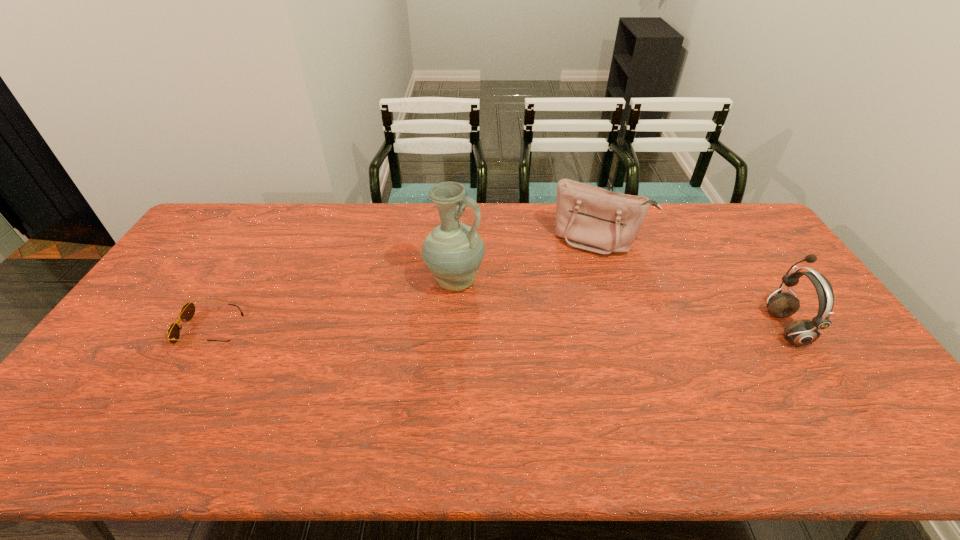
Find the location of `free space located on the ear pads of the rightmost object`. free space located on the ear pads of the rightmost object is located at coordinates (708, 327).

I want to click on vacant space situated on the ear pads of the rightmost object, so click(x=652, y=327).

Where is `vacant space located on the handle side of the tallest object`? vacant space located on the handle side of the tallest object is located at coordinates (563, 366).

The height and width of the screenshot is (540, 960). I want to click on vacant region located on the handle side of the tallest object, so click(x=503, y=319).

The height and width of the screenshot is (540, 960). I want to click on free space located on the handle side of the tallest object, so click(493, 312).

Locate an element on the screen. vacant space located on the front pocket of the farthest object is located at coordinates (578, 278).

The width and height of the screenshot is (960, 540). I want to click on free space located on the front pocket of the farthest object, so click(x=572, y=293).

The image size is (960, 540). Identify the location of vacant region located on the front pocket of the farthest object. (571, 295).

Where is `object situated at the far edge`? The image size is (960, 540). object situated at the far edge is located at coordinates (590, 218).

Locate an element on the screen. The image size is (960, 540). object at the right edge is located at coordinates (803, 332).